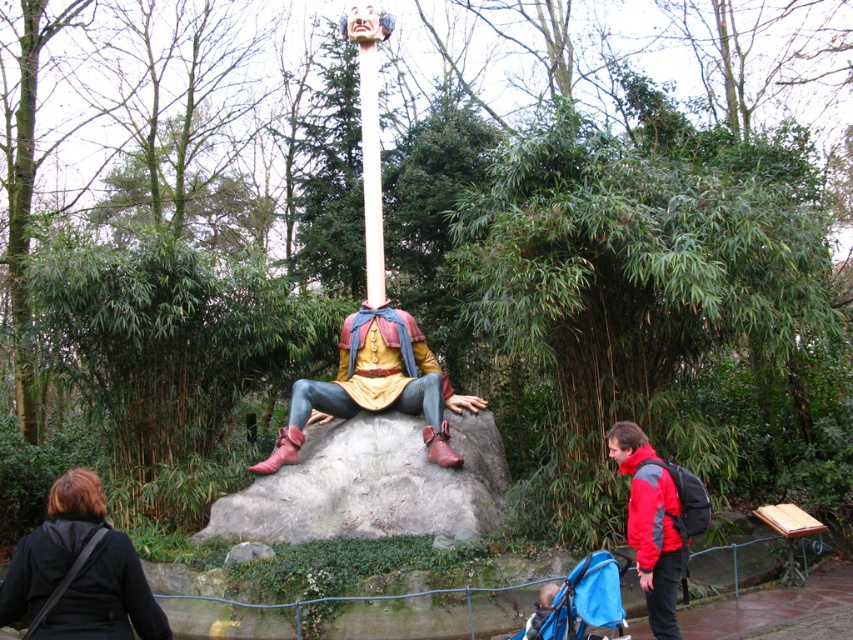
Question: Is matte painted wood figure at center above red jacket at lower right?

Choices:
 (A) no
 (B) yes

Answer: (B)

Question: Among these objects, which one is farthest from the camera?

Choices:
 (A) matte painted wood figure at center
 (B) red jacket at lower right
 (C) white smooth pole at center

Answer: (C)

Question: Which point appears farthest from the camera in this image?

Choices:
 (A) (358, 344)
 (B) (670, 525)
 (C) (374, 198)

Answer: (C)

Question: Among these points, which one is nearest to the camera?

Choices:
 (A) (428, 408)
 (B) (363, 67)
 (C) (665, 529)

Answer: (C)

Question: Can you confirm if matte painted wood figure at center is bigger than white smooth pole at center?

Choices:
 (A) no
 (B) yes

Answer: (B)

Question: Can you confirm if red jacket at lower right is positioned to the left of white smooth pole at center?

Choices:
 (A) yes
 (B) no

Answer: (B)